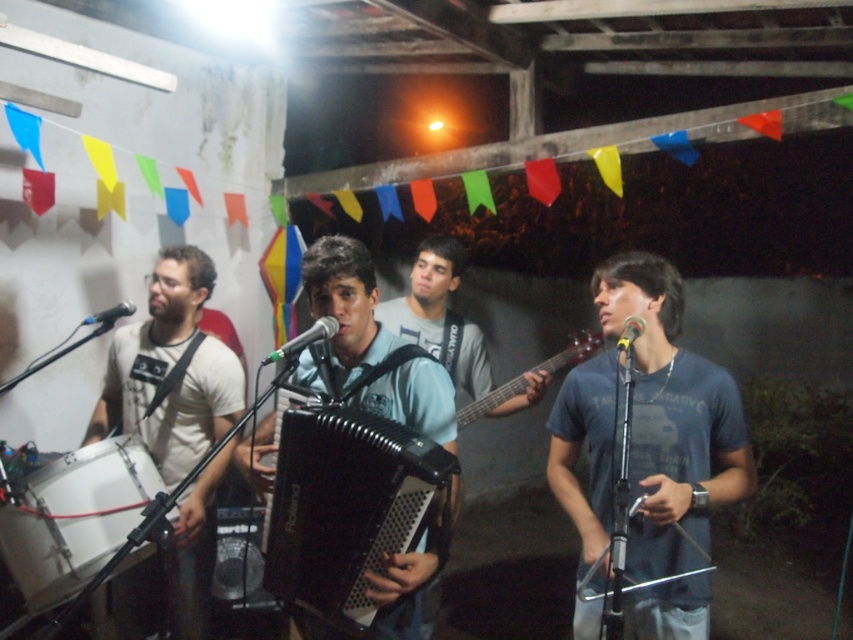
Question: Where is black plastic accordion at center located in relation to white matte t-shirt at left in the image?

Choices:
 (A) left
 (B) right

Answer: (B)

Question: Can you confirm if white matte t-shirt at left is positioned to the left of metallic silver guitar at center?

Choices:
 (A) no
 (B) yes

Answer: (B)

Question: In this image, where is black plastic accordion at center located relative to matte black accordion at center?

Choices:
 (A) below
 (B) above

Answer: (A)

Question: Which object is farther from the camera taking this photo?

Choices:
 (A) dark blue t-shirt at center
 (B) white drum at lower left
 (C) white matte t-shirt at left
 (D) matte black accordion at center

Answer: (D)

Question: Which of the following is the farthest from the observer?

Choices:
 (A) metallic silver guitar at center
 (B) white drum at lower left
 (C) black plastic accordion at center

Answer: (A)

Question: Which of the following is the closest to the observer?

Choices:
 (A) (515, 392)
 (B) (387, 620)
 (C) (686, 560)
 (D) (540, 384)

Answer: (B)